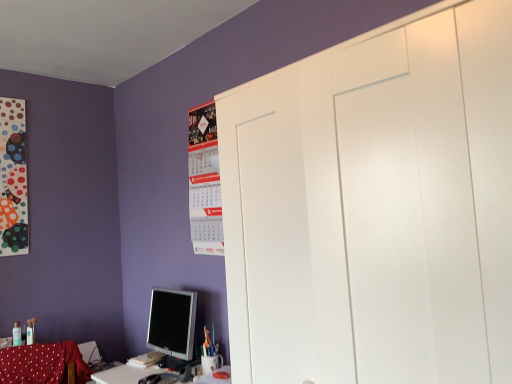
Question: Is matte silver monitor at lower left outside of red fabric swivel chair at lower left?

Choices:
 (A) no
 (B) yes

Answer: (B)

Question: Is matte silver monitor at lower left wider than red fabric swivel chair at lower left?

Choices:
 (A) yes
 (B) no

Answer: (A)

Question: Does matte silver monitor at lower left appear on the right side of red fabric swivel chair at lower left?

Choices:
 (A) yes
 (B) no

Answer: (A)

Question: Is matte silver monitor at lower left bigger than red fabric swivel chair at lower left?

Choices:
 (A) no
 (B) yes

Answer: (B)

Question: Is matte silver monitor at lower left smaller than red fabric swivel chair at lower left?

Choices:
 (A) yes
 (B) no

Answer: (B)

Question: Is matte paper calendar at upper center to the left or to the right of matte silver monitor at lower left in the image?

Choices:
 (A) left
 (B) right

Answer: (B)

Question: Is matte paper calendar at upper center taller or shorter than matte silver monitor at lower left?

Choices:
 (A) short
 (B) tall

Answer: (B)

Question: Choose the correct answer: Is matte paper calendar at upper center inside matte silver monitor at lower left or outside it?

Choices:
 (A) outside
 (B) inside

Answer: (A)

Question: Considering the positions of matte paper calendar at upper center and matte silver monitor at lower left in the image, is matte paper calendar at upper center wider or thinner than matte silver monitor at lower left?

Choices:
 (A) thin
 (B) wide

Answer: (A)

Question: From the image's perspective, is red fabric swivel chair at lower left located above or below matte paper calendar at upper center?

Choices:
 (A) below
 (B) above

Answer: (A)

Question: From a real-world perspective, is red fabric swivel chair at lower left positioned above or below matte paper calendar at upper center?

Choices:
 (A) above
 (B) below

Answer: (B)

Question: Is red fabric swivel chair at lower left inside the boundaries of matte paper calendar at upper center, or outside?

Choices:
 (A) outside
 (B) inside

Answer: (A)

Question: Does point (11, 372) appear closer or farther from the camera than point (217, 223)?

Choices:
 (A) farther
 (B) closer

Answer: (B)

Question: From the image's perspective, is matte silver monitor at lower left located above or below matte paper calendar at upper center?

Choices:
 (A) below
 (B) above

Answer: (A)

Question: Is point (169, 339) closer or farther from the camera than point (219, 208)?

Choices:
 (A) closer
 (B) farther

Answer: (A)